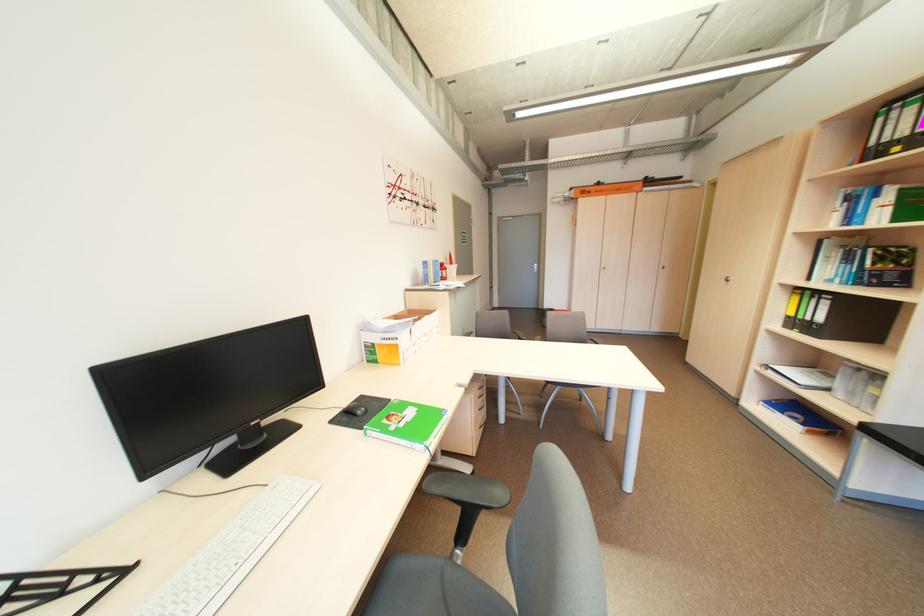
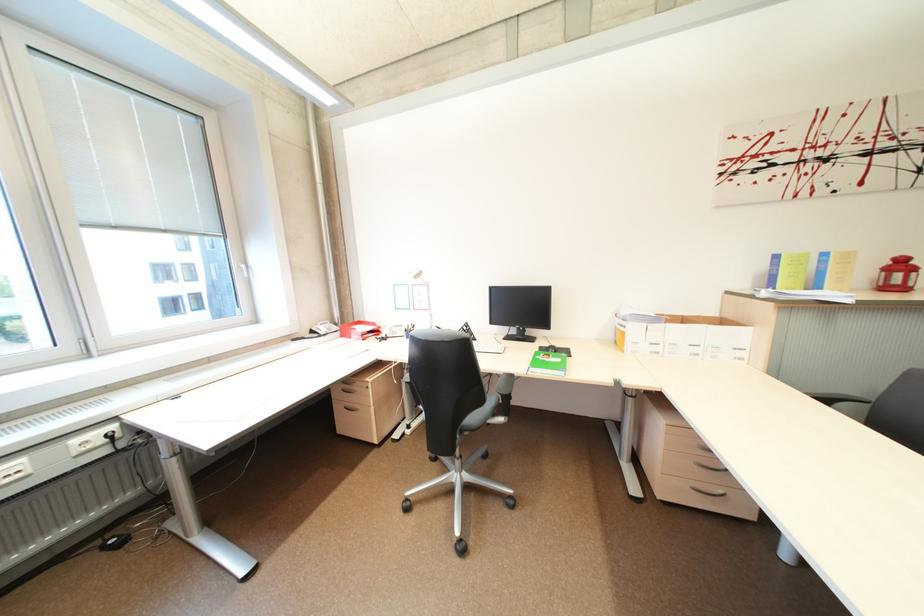
Find the pixel in the second image that matches (406,347) in the first image.

(633, 334)